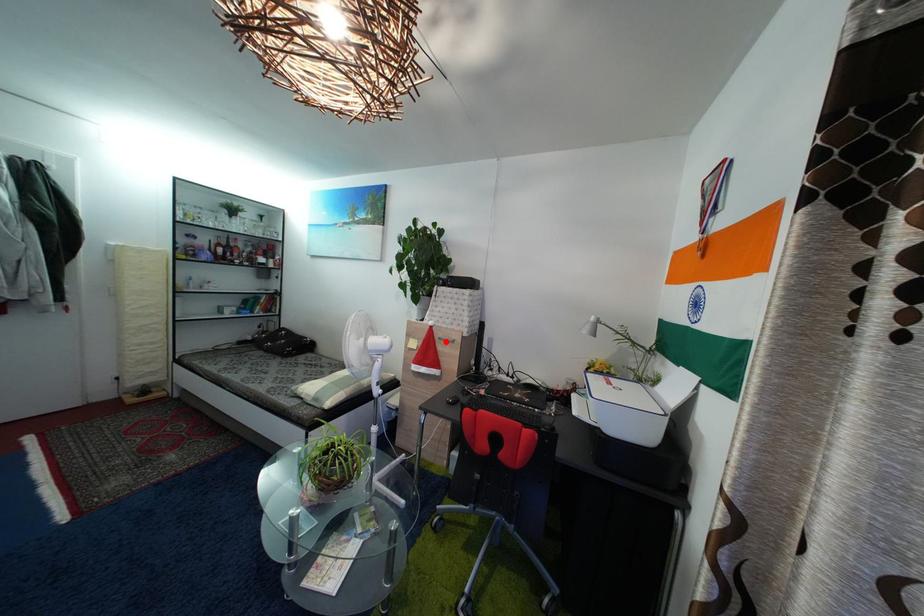
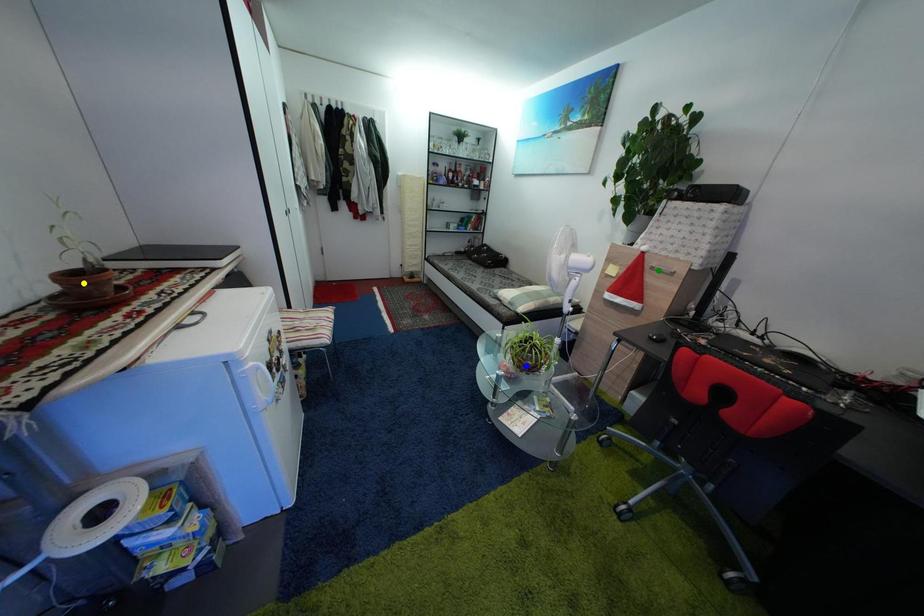
Question: I am providing you with two images of the same scene from different viewpoints. A red point is marked on the first image. You are given multiple points on the second image. Which spot in image 2 lines up with the point in image 1?

Choices:
 (A) blue point
 (B) yellow point
 (C) green point

Answer: (C)